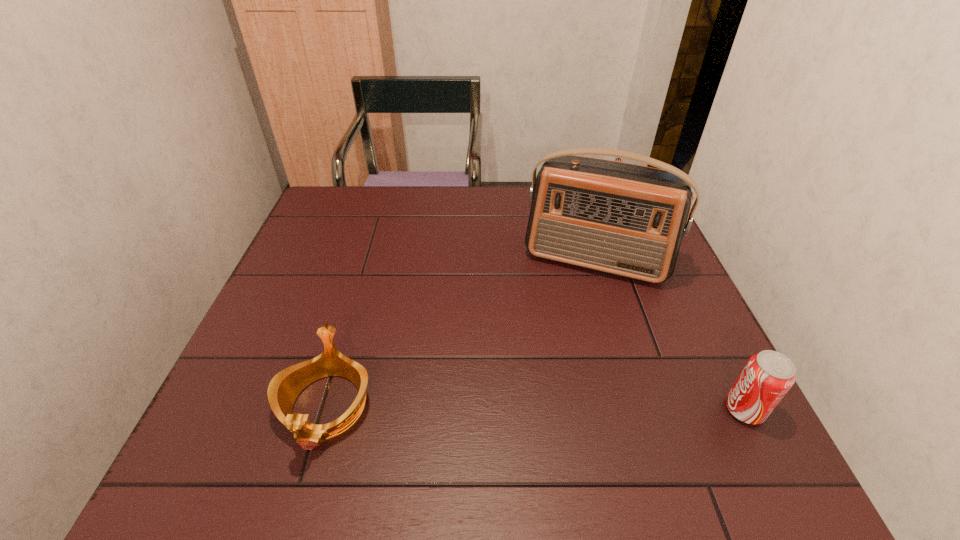
Where is `vacant area situated 0.190m on the front-facing side of the radio receiver`? The image size is (960, 540). vacant area situated 0.190m on the front-facing side of the radio receiver is located at coordinates (562, 342).

This screenshot has width=960, height=540. In order to click on free space located on the front-facing side of the puncher in this screenshot , I will do `click(603, 228)`.

Find the location of `free space located 0.390m on the front-facing side of the puncher`. free space located 0.390m on the front-facing side of the puncher is located at coordinates (597, 281).

Identify the location of vacant space situated 0.080m on the front-facing side of the puncher. (604, 216).

Locate an element on the screen. The width and height of the screenshot is (960, 540). object that is at the far edge is located at coordinates tap(617, 159).

This screenshot has height=540, width=960. What are the coordinates of `tiara that is at the near edge` in the screenshot? It's located at (284, 388).

This screenshot has height=540, width=960. I want to click on soda can located in the near edge section of the desktop, so click(x=767, y=376).

Find the location of a particular element. object positioned at the left edge is located at coordinates (284, 388).

Locate an element on the screen. soda can positioned at the right edge is located at coordinates 767,376.

Identify the location of radio receiver present at the right edge. (625, 219).